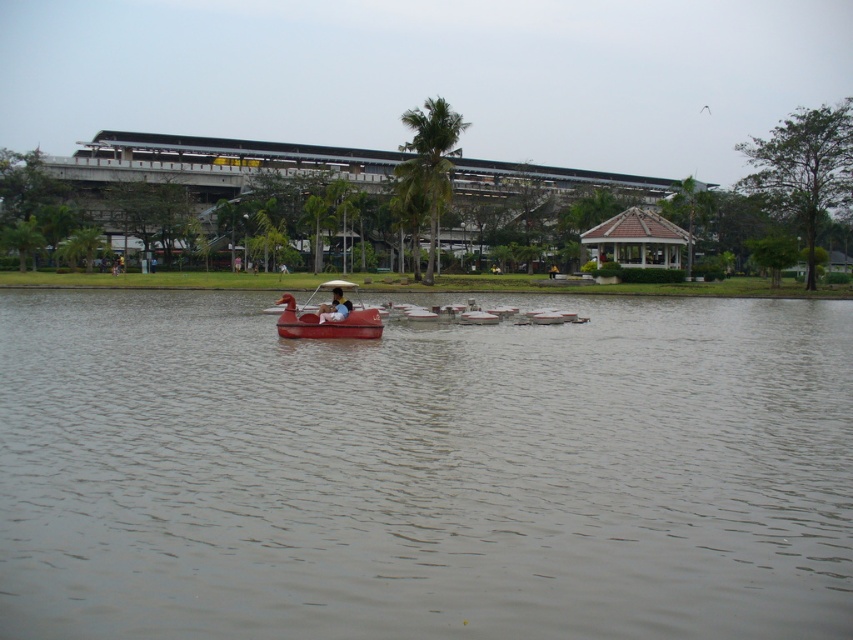
Which is below, transparent plastic water at center or rubber duck boat at center?

transparent plastic water at center is lower down.

Looking at this image, does transparent plastic water at center appear under rubber duck boat at center?

Yes, transparent plastic water at center is below rubber duck boat at center.

Identify the location of transparent plastic water at center. This screenshot has width=853, height=640. (424, 472).

Which is in front, point (310, 310) or point (320, 314)?

Point (320, 314)

The image size is (853, 640). What do you see at coordinates (329, 316) in the screenshot?
I see `rubber duck boat at center` at bounding box center [329, 316].

Is point (309, 326) positioned in front of point (337, 321)?

Yes, point (309, 326) is in front of point (337, 321).

Where is `rubber duck boat at center`? The width and height of the screenshot is (853, 640). rubber duck boat at center is located at coordinates (329, 316).

Between transparent plastic water at center and white plastic boat at center, which one has less height?

white plastic boat at center is shorter.

Does point (631, 499) come behind point (558, 321)?

No, it is in front of (558, 321).

Where is `transparent plastic water at center`? Image resolution: width=853 pixels, height=640 pixels. transparent plastic water at center is located at coordinates (424, 472).

Where is `transparent plastic water at center`? transparent plastic water at center is located at coordinates (424, 472).